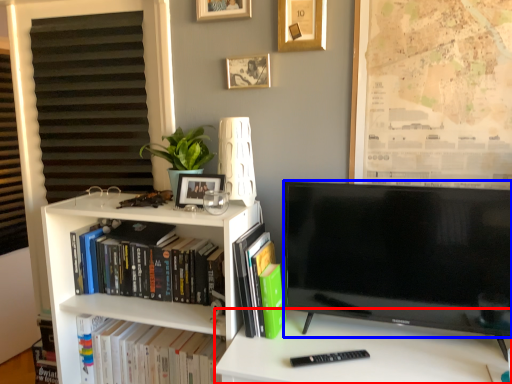
Question: Which point is further to the camera, desk (highlighted by a red box) or television (highlighted by a blue box)?

Choices:
 (A) desk
 (B) television

Answer: (B)